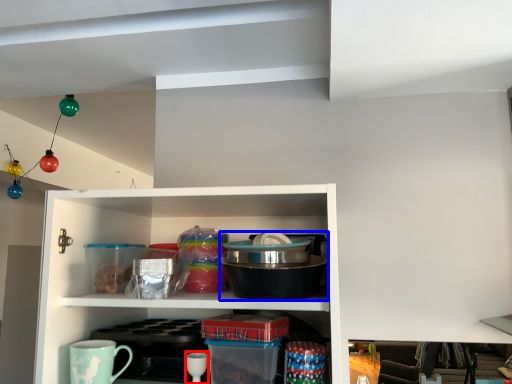
Question: Which of the following is the closest to the observer, tableware (highlighted by a red box) or appliance (highlighted by a blue box)?

Choices:
 (A) tableware
 (B) appliance

Answer: (B)